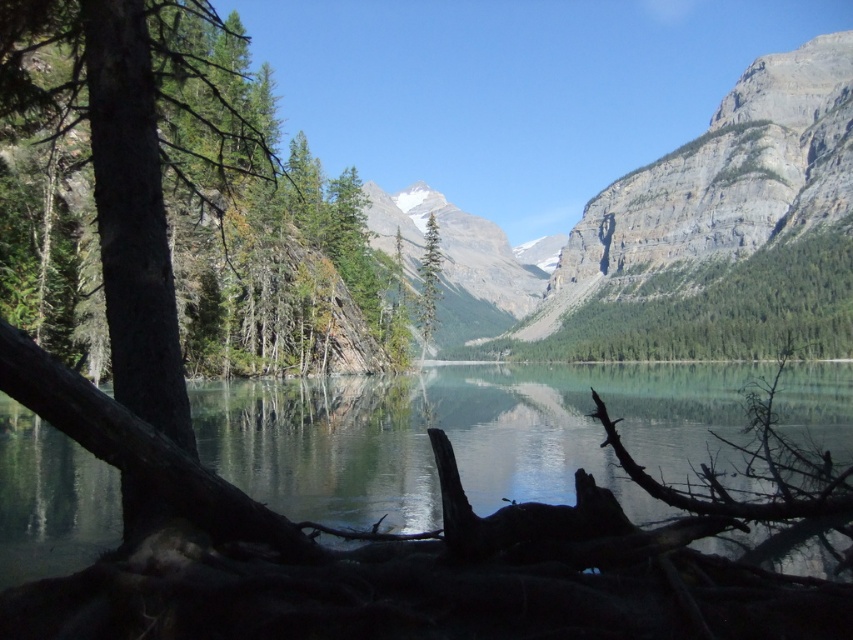
You are standing at the edge of the lake and see two points marked on the image. Which point, point (759, 364) or point (439, 264), is closer to you?

Point (759, 364) is closer to you because it is further to the viewer than point (439, 264).